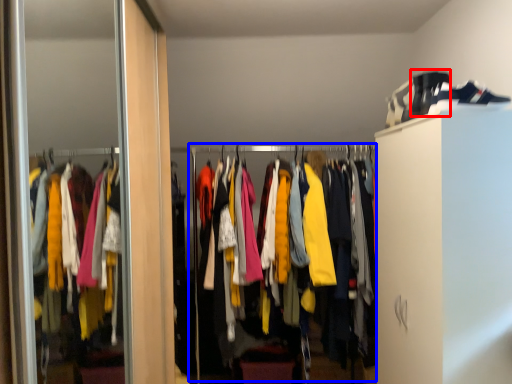
Question: Among these objects, which one is farthest to the camera, shoe (highlighted by a red box) or closet (highlighted by a blue box)?

Choices:
 (A) shoe
 (B) closet

Answer: (B)